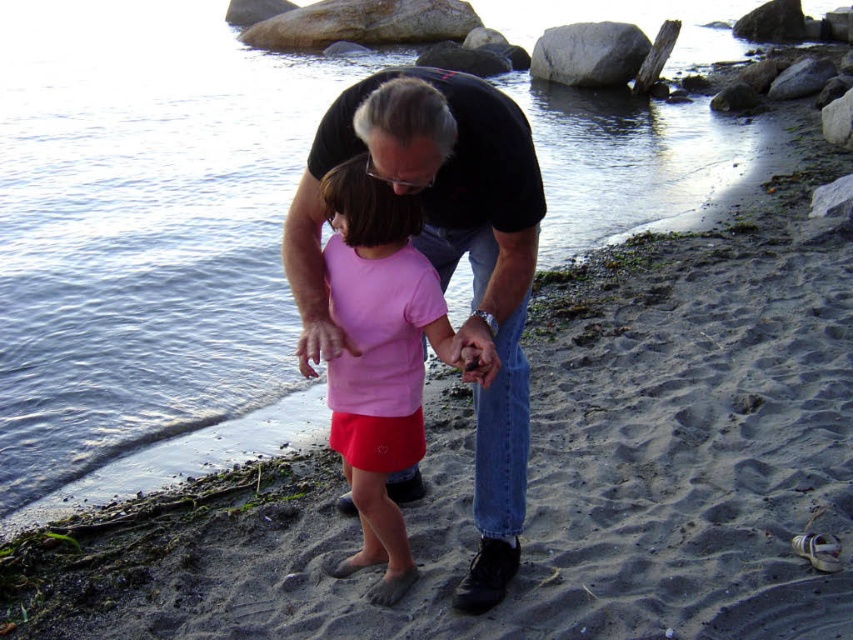
Between pink matte shirt at center and smooth gray rock at upper center, which one has less height?

Standing shorter between the two is smooth gray rock at upper center.

The width and height of the screenshot is (853, 640). I want to click on pink matte shirt at center, so click(x=378, y=356).

Find the location of a particular element. This screenshot has width=853, height=640. pink matte shirt at center is located at coordinates (378, 356).